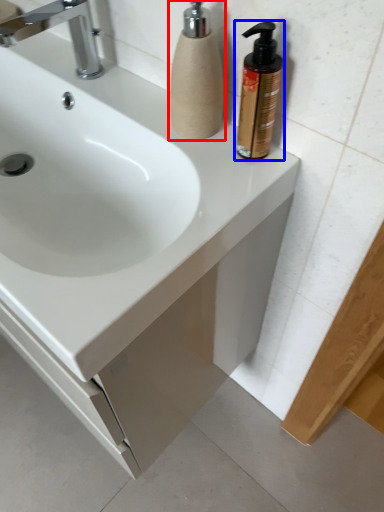
Question: Which point is closer to the camera, soap dispenser (highlighted by a red box) or soap dispenser (highlighted by a blue box)?

Choices:
 (A) soap dispenser
 (B) soap dispenser

Answer: (B)